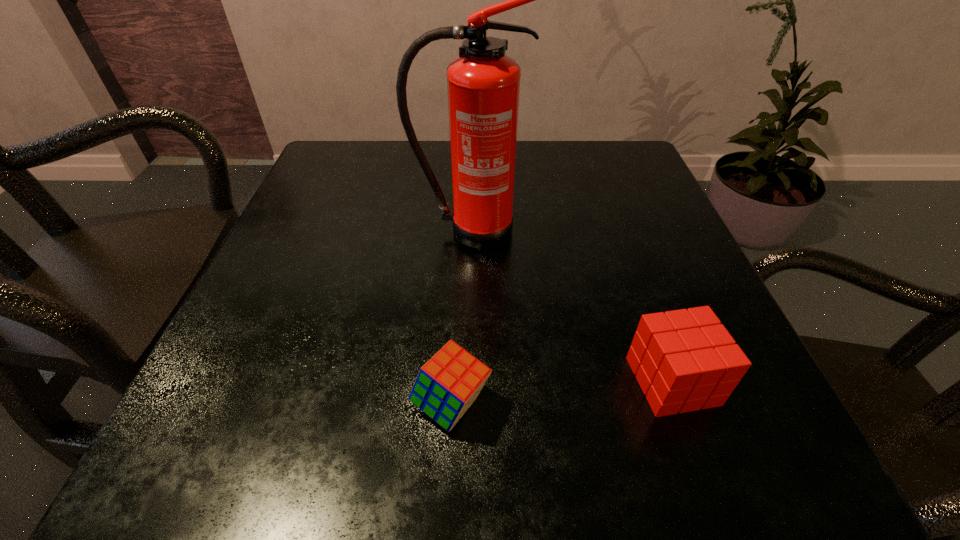
Where is `vacant area at the near edge`? vacant area at the near edge is located at coordinates (330, 450).

The height and width of the screenshot is (540, 960). Identify the location of free region at the left edge of the desktop. (370, 208).

At what (x,y) coordinates should I click in order to perform the action: click on free space at the right edge of the desktop. Please return your answer as a coordinate pair (x, y). This screenshot has height=540, width=960. Looking at the image, I should click on (617, 313).

The height and width of the screenshot is (540, 960). Identify the location of blank space at the far left corner. (327, 183).

The height and width of the screenshot is (540, 960). Identify the location of free region at the near left corner of the desktop. (252, 414).

The height and width of the screenshot is (540, 960). Identify the location of vacant region at the far right corner of the desktop. (600, 154).

The image size is (960, 540). I want to click on vacant area at the near right corner of the desktop, so click(x=689, y=454).

At what (x,y) coordinates should I click in order to perform the action: click on free point between the left cube and the right cube. Please return your answer as a coordinate pair (x, y). Looking at the image, I should click on (562, 393).

This screenshot has height=540, width=960. What are the coordinates of `free space between the tallest object and the rightmost object` in the screenshot? It's located at (570, 306).

Locate an element on the screen. The height and width of the screenshot is (540, 960). free spot between the farthest object and the left cube is located at coordinates (460, 318).